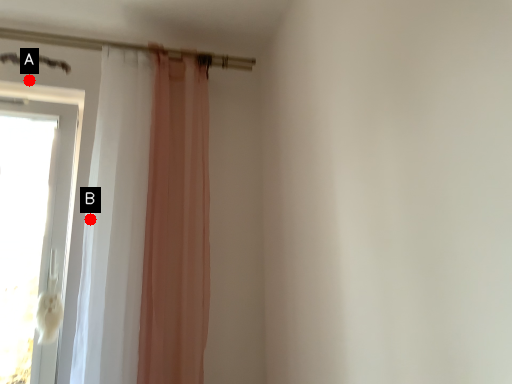
Question: Two points are circled on the image, labeled by A and B beside each circle. Among these points, which one is nearest to the camera?

Choices:
 (A) A is closer
 (B) B is closer

Answer: (B)